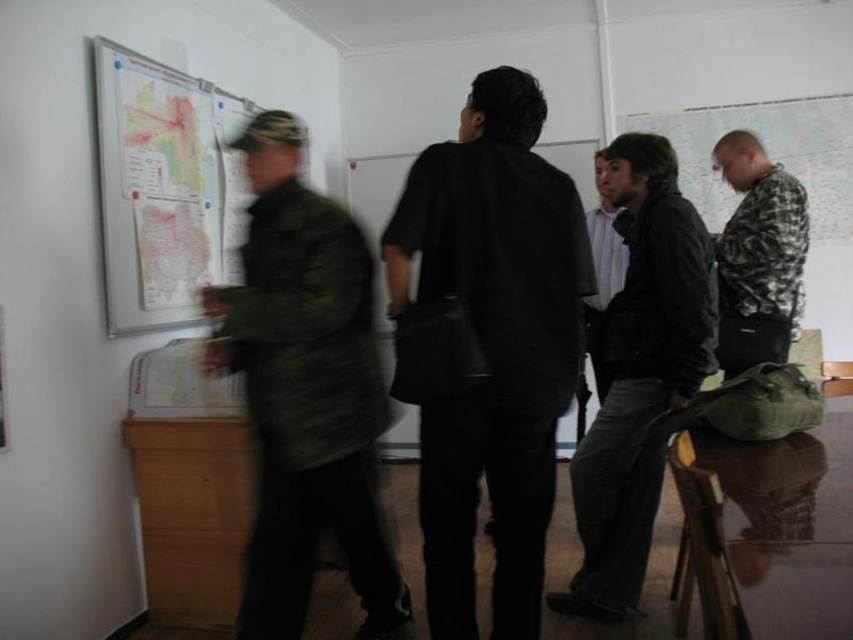
Is camouflage jacket at left below matte black jacket at center?

Yes, camouflage jacket at left is below matte black jacket at center.

Can you confirm if camouflage jacket at left is thinner than matte black jacket at center?

No, camouflage jacket at left is not thinner than matte black jacket at center.

Is point (294, 259) positioned behind point (595, 182)?

No.

The width and height of the screenshot is (853, 640). In order to click on camouflage jacket at left in this screenshot , I will do `click(305, 392)`.

This screenshot has height=640, width=853. What are the coordinates of `camouflage jacket at left` in the screenshot? It's located at (305, 392).

This screenshot has width=853, height=640. I want to click on camouflage jacket at left, so click(305, 392).

Which is in front, point (183, 241) or point (602, 186)?

Point (602, 186)

Identify the location of map paper at upper left. The width and height of the screenshot is (853, 640). (164, 188).